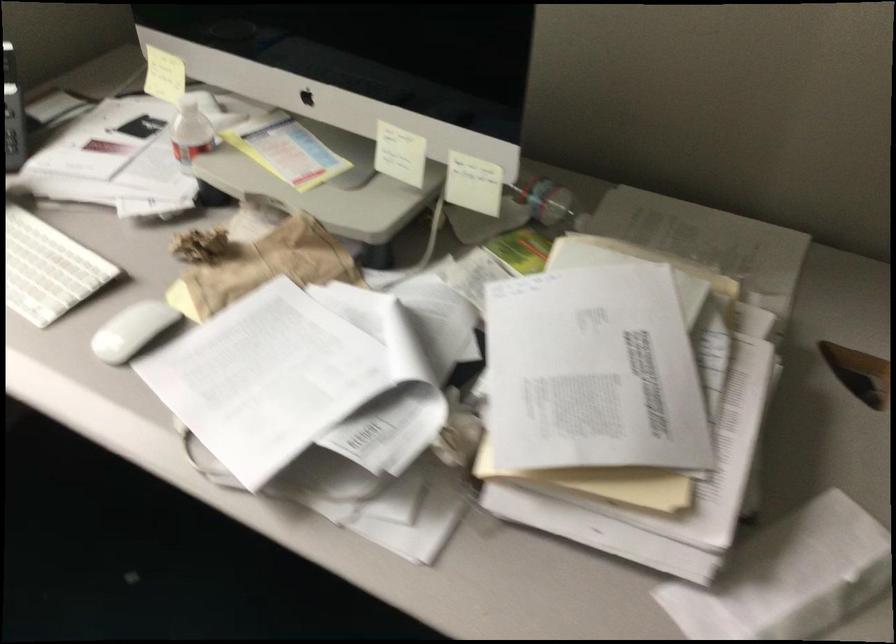
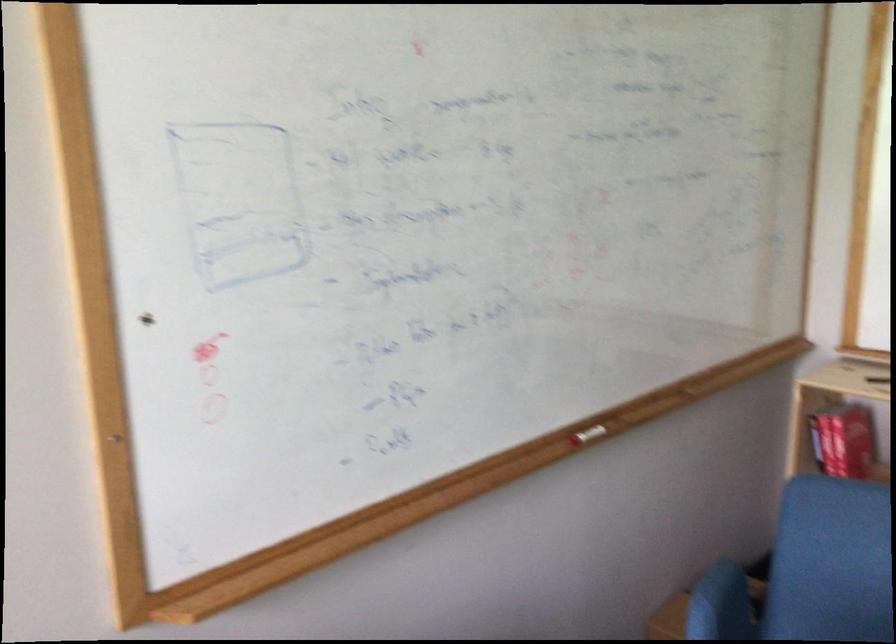
Question: The images are taken continuously from a first-person perspective. In which direction is your viewpoint rotating?

Choices:
 (A) Left
 (B) Right
 (C) Up
 (D) Down

Answer: (B)